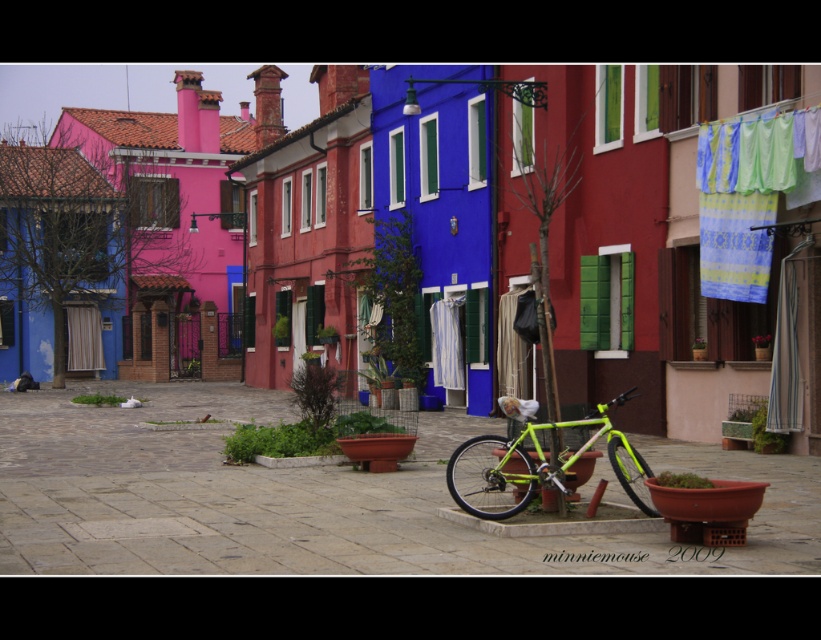
Does neon green bicycle at center lie in front of neon green frame at center?

Yes, it is.

Is point (427, 556) farther from viewer compared to point (464, 449)?

No, (427, 556) is in front of (464, 449).

Is point (7, 483) positioned after point (478, 515)?

Yes, it is behind point (478, 515).

This screenshot has width=821, height=640. Identify the location of neon green bicycle at center. (317, 499).

Does point (774, 216) lie behind point (507, 492)?

Yes, point (774, 216) is behind point (507, 492).

Between blue striped fabric at upper right and neon green frame at center, which one is positioned lower?

neon green frame at center

Does point (768, 141) come farther from viewer compared to point (519, 477)?

Yes.

Identify the location of blue striped fabric at upper right. The image size is (821, 640). (744, 196).

Is neon green bicycle at center thinner than blue striped fabric at upper right?

No.

Does neon green bicycle at center have a greater width compared to blue striped fabric at upper right?

Correct, the width of neon green bicycle at center exceeds that of blue striped fabric at upper right.

Is point (177, 554) behind point (778, 145)?

No.

Locate an element on the screen. neon green bicycle at center is located at coordinates click(317, 499).